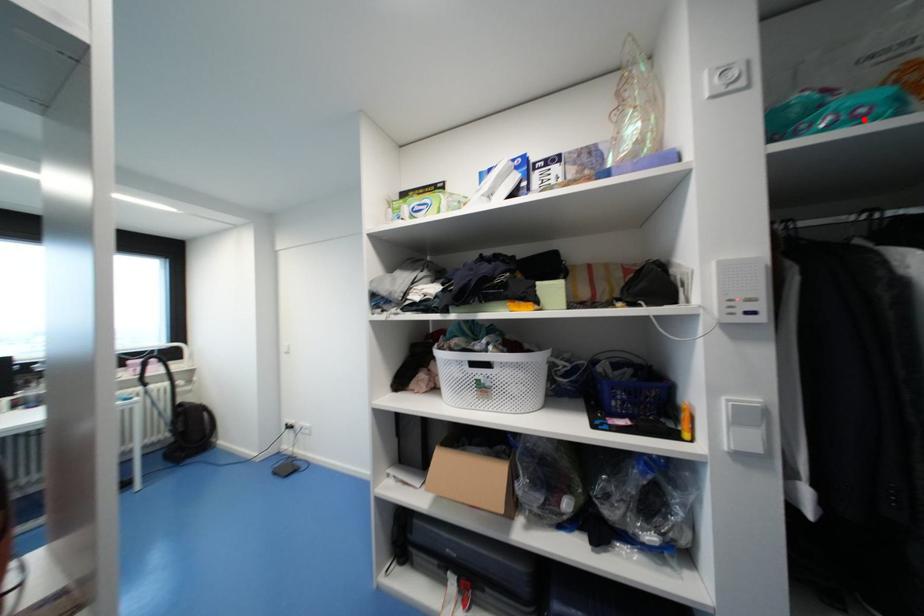
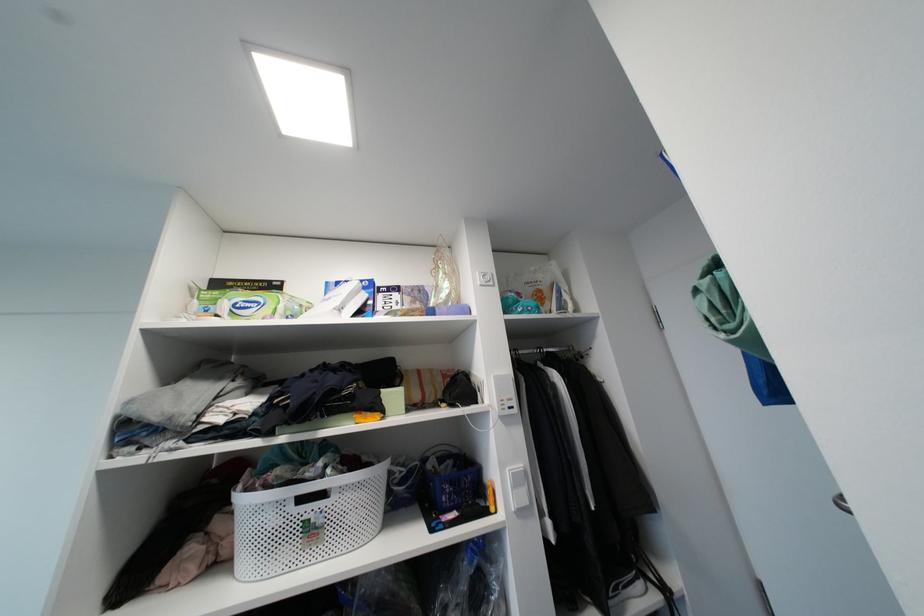
Question: I am providing you with two images of the same scene from different viewpoints. A red point is marked on the first image. Can you still see the location of the red point in image 2?

Choices:
 (A) Yes
 (B) No

Answer: (A)